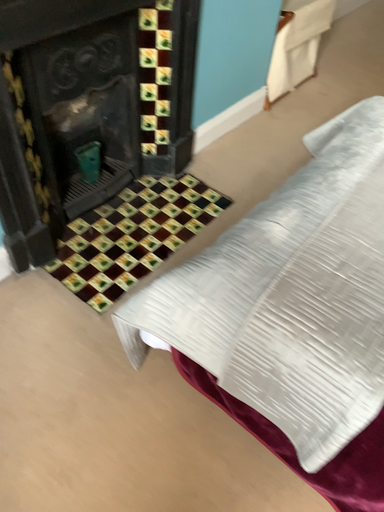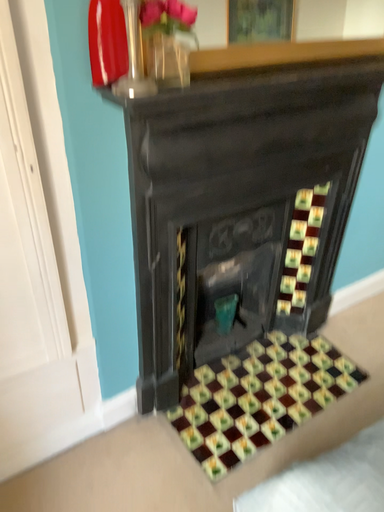
Question: How did the camera likely rotate when shooting the video?

Choices:
 (A) rotated downward
 (B) rotated upward

Answer: (B)